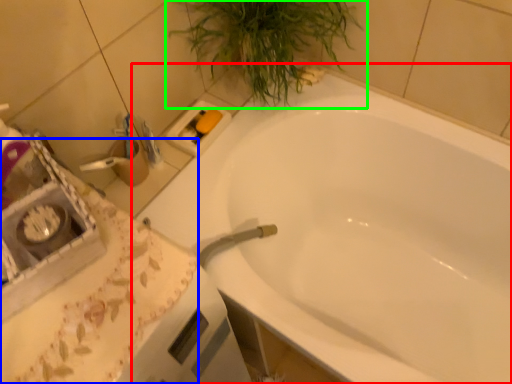
Question: Which object is the closest to the bathtub (highlighted by a red box)? Choose among these: counter top (highlighted by a blue box) or houseplant (highlighted by a green box).

Choices:
 (A) counter top
 (B) houseplant

Answer: (B)